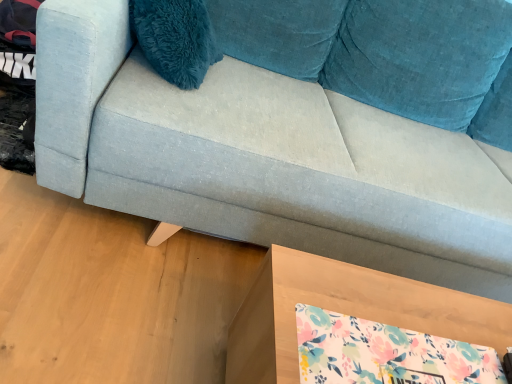
Question: Should I look upward or downward to see light blue fabric couch at center?

Choices:
 (A) down
 (B) up

Answer: (B)

Question: Can you confirm if wooden table at lower right is positioned to the right of light blue fabric couch at center?

Choices:
 (A) no
 (B) yes

Answer: (A)

Question: Considering the relative sizes of wooden table at lower right and light blue fabric couch at center in the image provided, is wooden table at lower right thinner than light blue fabric couch at center?

Choices:
 (A) yes
 (B) no

Answer: (A)

Question: Does wooden table at lower right have a greater width compared to light blue fabric couch at center?

Choices:
 (A) yes
 (B) no

Answer: (B)

Question: Does wooden table at lower right have a smaller size compared to light blue fabric couch at center?

Choices:
 (A) no
 (B) yes

Answer: (B)

Question: Does wooden table at lower right have a larger size compared to light blue fabric couch at center?

Choices:
 (A) yes
 (B) no

Answer: (B)

Question: From the image's perspective, is wooden table at lower right on top of light blue fabric couch at center?

Choices:
 (A) no
 (B) yes

Answer: (A)

Question: Is light blue fabric couch at center at the left side of wooden table at lower right?

Choices:
 (A) no
 (B) yes

Answer: (A)

Question: From the image's perspective, is light blue fabric couch at center located beneath wooden table at lower right?

Choices:
 (A) no
 (B) yes

Answer: (A)

Question: Is light blue fabric couch at center aimed at wooden table at lower right?

Choices:
 (A) yes
 (B) no

Answer: (A)

Question: Are light blue fabric couch at center and wooden table at lower right far apart?

Choices:
 (A) yes
 (B) no

Answer: (B)

Question: Is light blue fabric couch at center smaller than wooden table at lower right?

Choices:
 (A) yes
 (B) no

Answer: (B)

Question: Is light blue fabric couch at center beside wooden table at lower right?

Choices:
 (A) no
 (B) yes

Answer: (A)

Question: From a real-world perspective, relative to wooden table at lower right, is light blue fabric couch at center vertically above or below?

Choices:
 (A) above
 (B) below

Answer: (A)